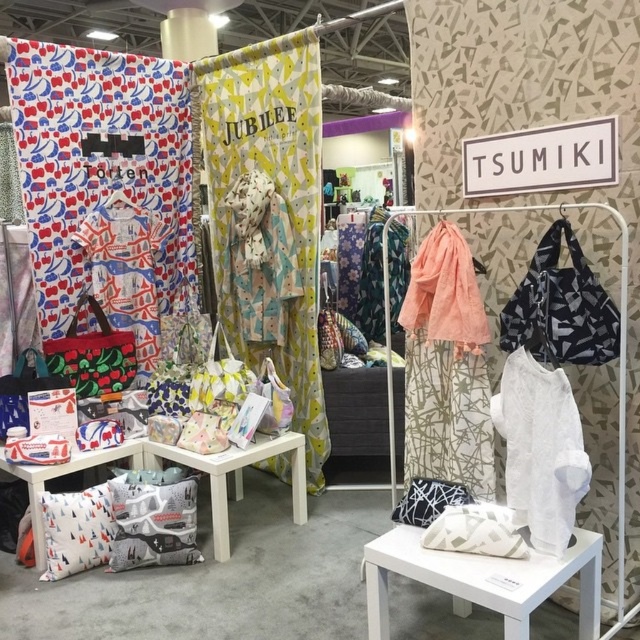
Question: Which of the following is the farthest from the observer?

Choices:
 (A) (456, 280)
 (B) (534, 408)
 (C) (109, 275)
 (D) (372, 221)

Answer: (D)

Question: Is white sheer fabric at center to the right of matte fabric bag at left from the viewer's perspective?

Choices:
 (A) yes
 (B) no

Answer: (A)

Question: Based on their relative distances, which object is nearer to the matte fabric bag at left?

Choices:
 (A) peach lace scarf at center
 (B) printed fabric dress at center

Answer: (B)

Question: Can you confirm if white sheer fabric at center is bigger than printed fabric dress at center?

Choices:
 (A) no
 (B) yes

Answer: (A)

Question: Based on their relative distances, which object is nearer to the white fabric stool at center?

Choices:
 (A) printed fabric dress at center
 (B) patterned fabric dress at center
 (C) peach lace scarf at center
 (D) matte fabric bag at left

Answer: (C)

Question: Is white fabric stool at center thinner than peach lace scarf at center?

Choices:
 (A) no
 (B) yes

Answer: (A)